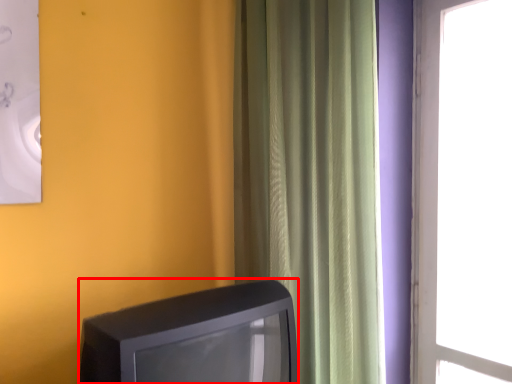
Question: Observing the image, what is the correct spatial positioning of television (annotated by the red box) in reference to curtain?

Choices:
 (A) right
 (B) left

Answer: (B)